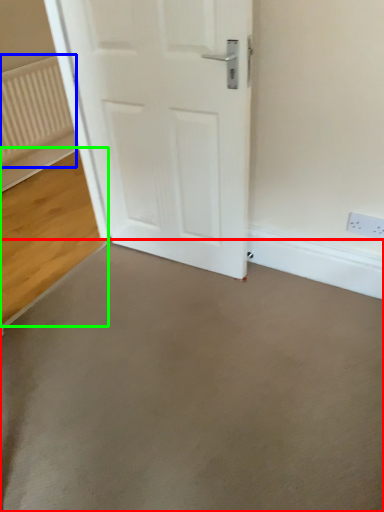
Question: Which is farther away from concrete (highlighted by a red box)? radiator (highlighted by a blue box) or concrete (highlighted by a green box)?

Choices:
 (A) radiator
 (B) concrete

Answer: (A)